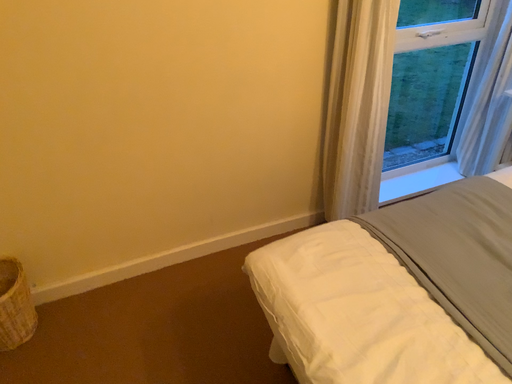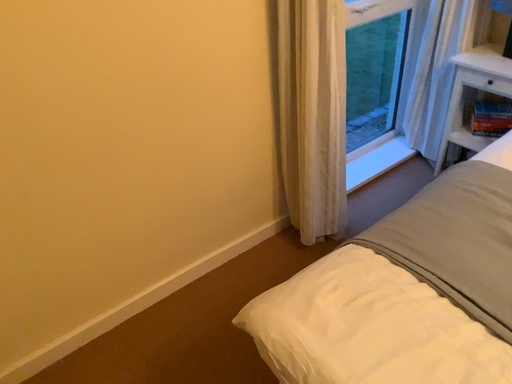
Question: Which way did the camera rotate in the video?

Choices:
 (A) rotated right
 (B) rotated left

Answer: (A)